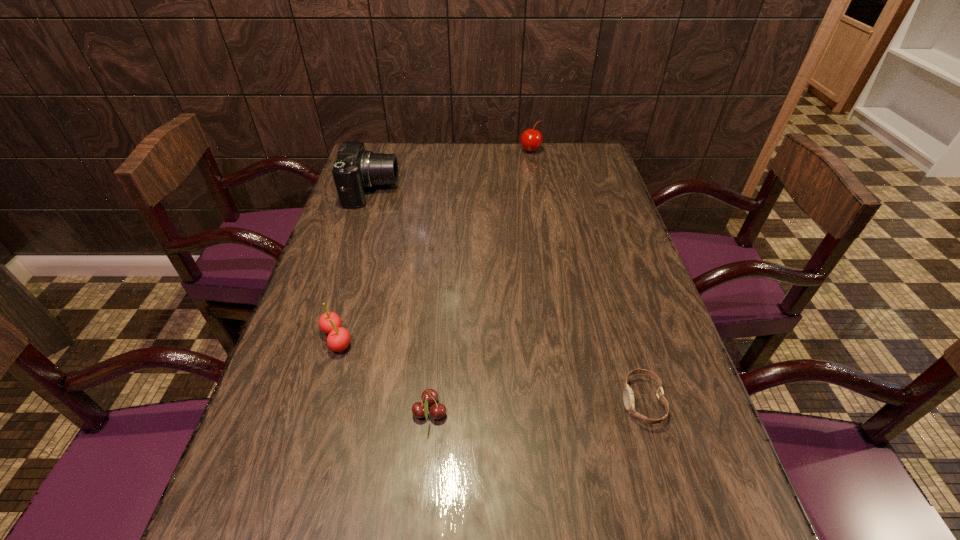
The height and width of the screenshot is (540, 960). I want to click on vacant space located 0.250m on the lens of the camera, so click(x=474, y=191).

You are a GUI agent. You are given a task and a screenshot of the screen. Output one action in this format:
    pyautogui.click(x=<x>, y=<y>)
    Task: Click on the blank area located on the right of the rightmost cherry
    The height and width of the screenshot is (540, 960).
    Given the screenshot: What is the action you would take?
    599,151

This screenshot has height=540, width=960. I want to click on free space located on the back of the third nearest object, so click(x=368, y=232).

Where is `vacant space located on the leaves of the shortest cherry`? The image size is (960, 540). vacant space located on the leaves of the shortest cherry is located at coordinates (544, 412).

You are a GUI agent. You are given a task and a screenshot of the screen. Output one action in this format:
    pyautogui.click(x=<x>, y=<y>)
    Task: Click on the free space located 0.230m on the face of the rightmost object
    The width and height of the screenshot is (960, 540).
    Given the screenshot: What is the action you would take?
    pyautogui.click(x=508, y=402)

Identify the location of vacant region located on the face of the rightmost object. (522, 402).

You are a GUI agent. You are given a task and a screenshot of the screen. Output one action in this format:
    pyautogui.click(x=<x>, y=<y>)
    Task: Click on the free space located on the face of the rightmost object
    
    Given the screenshot: What is the action you would take?
    pyautogui.click(x=513, y=402)

Where is `camera that is positioned at the far edge`? camera that is positioned at the far edge is located at coordinates (355, 169).

Identify the location of cherry at the far edge. (531, 139).

You are a GUI agent. You are given a task and a screenshot of the screen. Output one action in this format:
    pyautogui.click(x=<x>, y=<y>)
    Task: Click on the camera that is positioned at the left edge
    
    Given the screenshot: What is the action you would take?
    pyautogui.click(x=355, y=169)